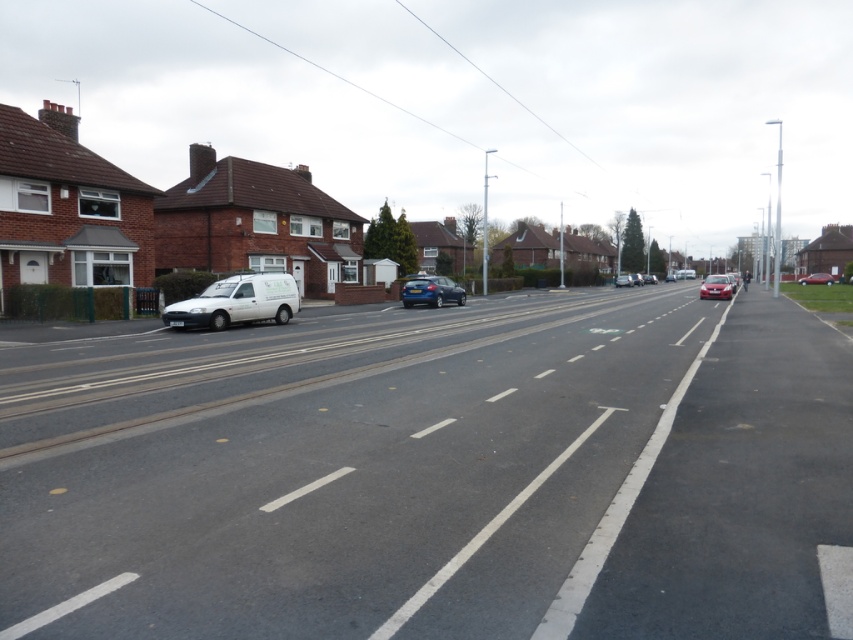
Does shiny blue sedan at center have a lesser height compared to matte white van at center?

Indeed, shiny blue sedan at center has a lesser height compared to matte white van at center.

Which of these two, shiny blue sedan at center or matte white van at center, stands taller?

Standing taller between the two is matte white van at center.

Is point (409, 278) closer to viewer compared to point (628, 280)?

Yes, point (409, 278) is in front of point (628, 280).

At what (x,y) coordinates should I click in order to perform the action: click on shiny blue sedan at center. Please return your answer as a coordinate pair (x, y). Looking at the image, I should click on (431, 291).

Between shiny red sedan at center and matte white van at center, which one appears on the left side from the viewer's perspective?

matte white van at center

Is point (717, 278) farther from camera compared to point (624, 284)?

No, (717, 278) is in front of (624, 284).

Where is `shiny red sedan at center`? shiny red sedan at center is located at coordinates (717, 285).

Is metallic red car at center wider than matte black car at center?

Yes, metallic red car at center is wider than matte black car at center.

Image resolution: width=853 pixels, height=640 pixels. Describe the element at coordinates (817, 278) in the screenshot. I see `metallic red car at center` at that location.

Locate an element on the screen. The image size is (853, 640). metallic red car at center is located at coordinates (817, 278).